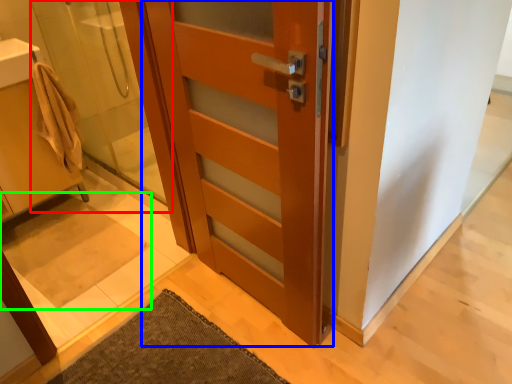
Question: Considering the real-world distances, which object is farthest from shower door (highlighted by a red box)? door (highlighted by a blue box) or bath mat (highlighted by a green box)?

Choices:
 (A) door
 (B) bath mat

Answer: (A)